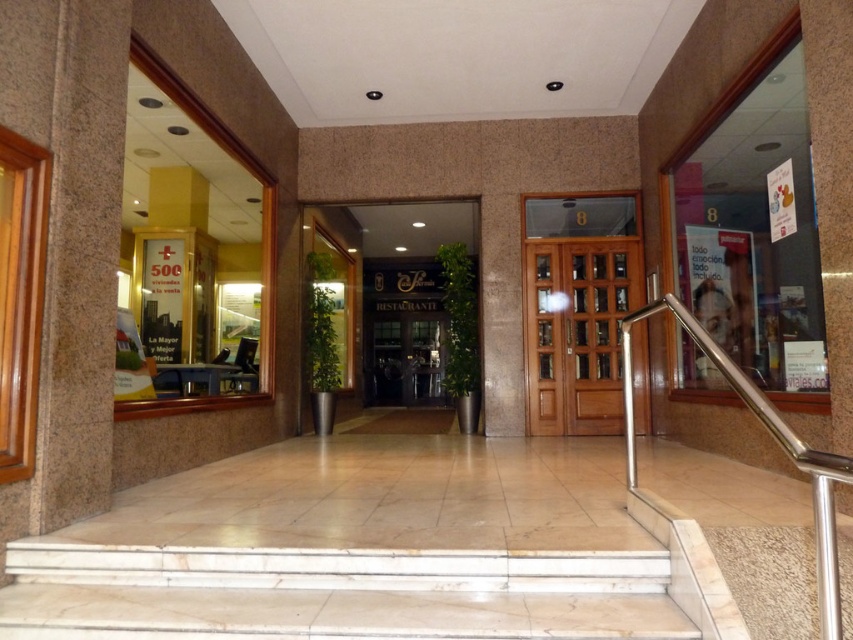
Does mahogany wood door at center have a lesser height compared to dark brown wooden door at center?

Indeed, mahogany wood door at center has a lesser height compared to dark brown wooden door at center.

Between point (645, 332) and point (405, 317), which one is positioned in front?

Positioned in front is point (645, 332).

Where is `mahogany wood door at center`? mahogany wood door at center is located at coordinates (577, 332).

Describe the element at coordinates (577, 332) in the screenshot. I see `mahogany wood door at center` at that location.

Does mahogany wood door at center appear on the right side of polished stainless steel handrail at right?

Indeed, mahogany wood door at center is positioned on the right side of polished stainless steel handrail at right.

Does point (613, 337) come farther from viewer compared to point (630, 433)?

Yes, it is.

Where is `mahogany wood door at center`? The height and width of the screenshot is (640, 853). mahogany wood door at center is located at coordinates (577, 332).

Does point (96, 284) come farther from viewer compared to point (421, 326)?

No, it is not.

Is granite pillar at left above dark brown wooden door at center?

Indeed, granite pillar at left is positioned over dark brown wooden door at center.

This screenshot has height=640, width=853. What do you see at coordinates (80, 262) in the screenshot?
I see `granite pillar at left` at bounding box center [80, 262].

The width and height of the screenshot is (853, 640). I want to click on granite pillar at left, so click(80, 262).